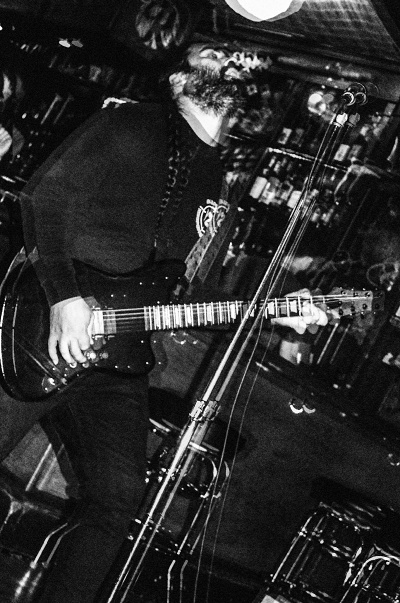
Identify the location of overhead light. (266, 14).